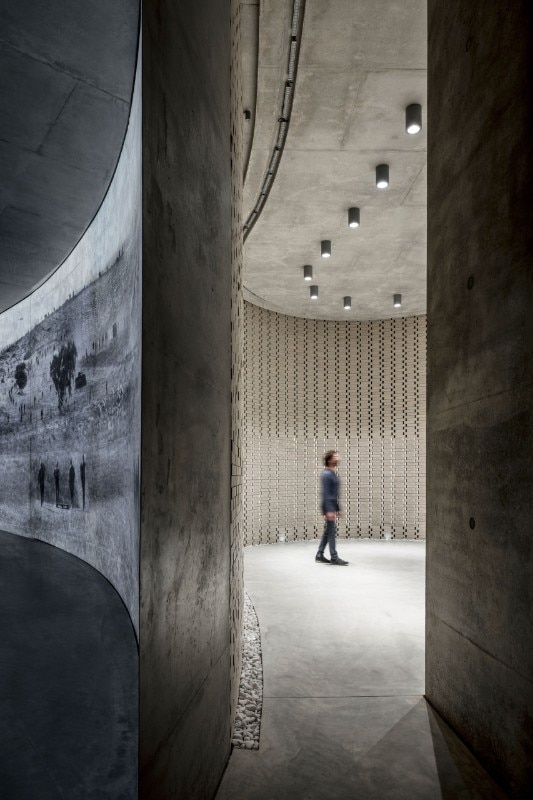
At what (x,y) coordinates should I click in order to perform the action: click on lights. Please return your answer as a coordinate pair (x, y). The width and height of the screenshot is (533, 800). Looking at the image, I should click on (416, 128), (386, 150), (354, 234), (332, 250), (308, 274), (314, 290), (349, 298), (395, 302).